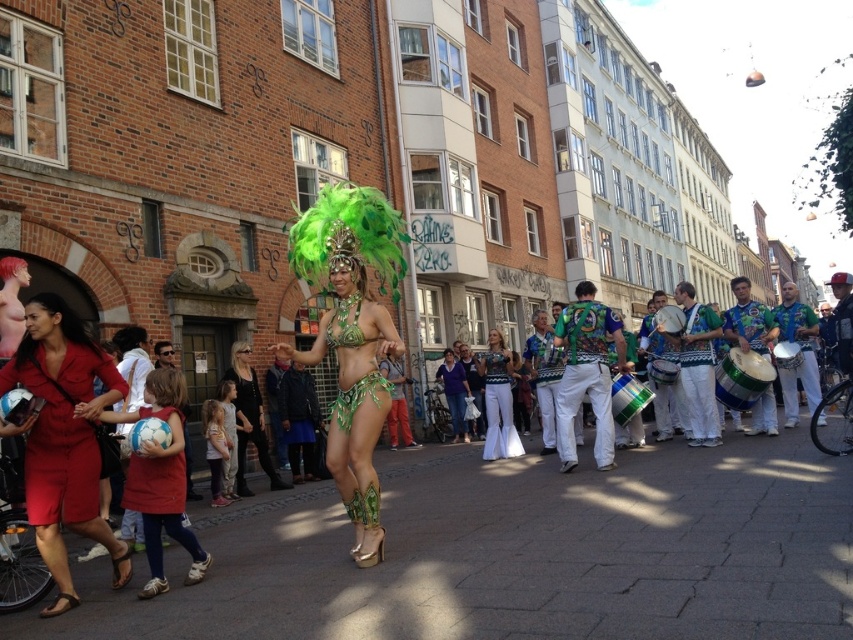
Who is positioned more to the left, green leafy bikini at center or green metallic drum at center?

green leafy bikini at center

Does green leafy bikini at center have a greater width compared to green metallic drum at center?

In fact, green leafy bikini at center might be narrower than green metallic drum at center.

From the picture: Who is more forward, (332,332) or (714,385)?

Point (332,332)

At what (x,y) coordinates should I click in order to perform the action: click on green leafy bikini at center. Please return your answer as a coordinate pair (x, y). The image size is (853, 640). Looking at the image, I should click on (347, 324).

From the picture: Can you confirm if green metallic drum at center is wider than green fabric drum at center?

Correct, the width of green metallic drum at center exceeds that of green fabric drum at center.

Who is more forward, [769,374] or [666,369]?

Point [769,374] is in front.

Is point (715, 392) farther from camera compared to point (663, 378)?

That is False.

This screenshot has height=640, width=853. Find the location of `green metallic drum at center`. green metallic drum at center is located at coordinates (741, 378).

What do you see at coordinates (352, 337) in the screenshot? This screenshot has height=640, width=853. I see `green metallic bikini at center` at bounding box center [352, 337].

Can you confirm if green metallic bikini at center is smaller than white textured pants at center?

No.

Identify the location of green metallic bikini at center. (352, 337).